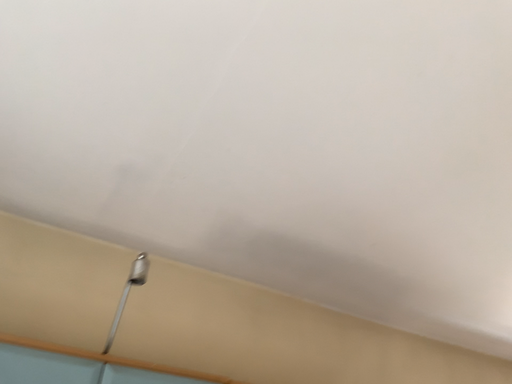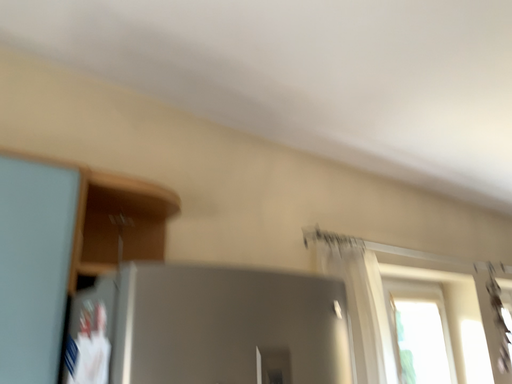
Question: Which way did the camera rotate in the video?

Choices:
 (A) rotated left
 (B) rotated right

Answer: (B)